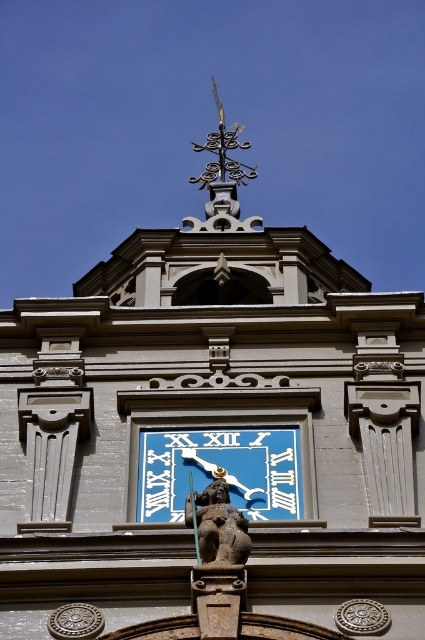
Between blue painted metal clock at center and polished brass weather vane at upper center, which one is positioned higher?

polished brass weather vane at upper center

Does blue painted metal clock at center come in front of polished brass weather vane at upper center?

Yes, blue painted metal clock at center is in front of polished brass weather vane at upper center.

Does point (297, 509) come in front of point (223, 225)?

Yes, it is in front of point (223, 225).

Identify the location of blue painted metal clock at center. This screenshot has height=640, width=425. (215, 468).

Between blue painted metal clock at center and brown stone lion at center, which one appears on the left side from the viewer's perspective?

brown stone lion at center is more to the left.

Between blue painted metal clock at center and brown stone lion at center, which one has more height?

Standing taller between the two is brown stone lion at center.

Image resolution: width=425 pixels, height=640 pixels. Describe the element at coordinates (215, 468) in the screenshot. I see `blue painted metal clock at center` at that location.

Where is `blue painted metal clock at center`? blue painted metal clock at center is located at coordinates (215, 468).

Who is taller, brown stone lion at center or polished brass weather vane at upper center?

Standing taller between the two is polished brass weather vane at upper center.

Is brown stone lion at center below polished brass weather vane at upper center?

Correct, brown stone lion at center is located below polished brass weather vane at upper center.

Is point (207, 563) behind point (209, 209)?

No, (207, 563) is closer to viewer.

Identify the location of brown stone lion at center. (217, 524).